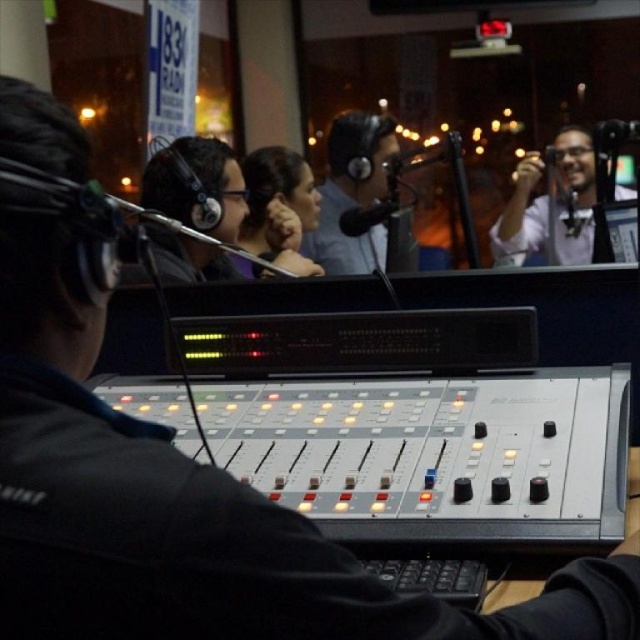
Does matte black headphones at center have a greater width compared to matte black hair at center?

Correct, the width of matte black headphones at center exceeds that of matte black hair at center.

Between point (349, 170) and point (250, 189), which one is positioned behind?

Positioned behind is point (349, 170).

The image size is (640, 640). What are the coordinates of `matte black headphones at center` in the screenshot? It's located at (353, 193).

Locate an element on the screen. This screenshot has height=640, width=640. matte black headphones at center is located at coordinates (353, 193).

Does matte black camera at upper right appear over matte black hair at center?

Actually, matte black camera at upper right is below matte black hair at center.

Is point (518, 225) behind point (298, 220)?

Yes.

Is point (564, 182) less distant than point (291, 168)?

Yes, point (564, 182) is closer to viewer.

The height and width of the screenshot is (640, 640). I want to click on matte black camera at upper right, so click(x=550, y=204).

Who is taller, matte black camera at upper right or matte black headphones at center?

matte black headphones at center is taller.

Does matte black camera at upper right appear on the left side of matte black headphones at center?

In fact, matte black camera at upper right is to the right of matte black headphones at center.

Is point (579, 236) behind point (324, 202)?

No.

At what (x,y) coordinates should I click in order to perform the action: click on matte black camera at upper right. Please return your answer as a coordinate pair (x, y). Image resolution: width=640 pixels, height=640 pixels. Looking at the image, I should click on (550, 204).